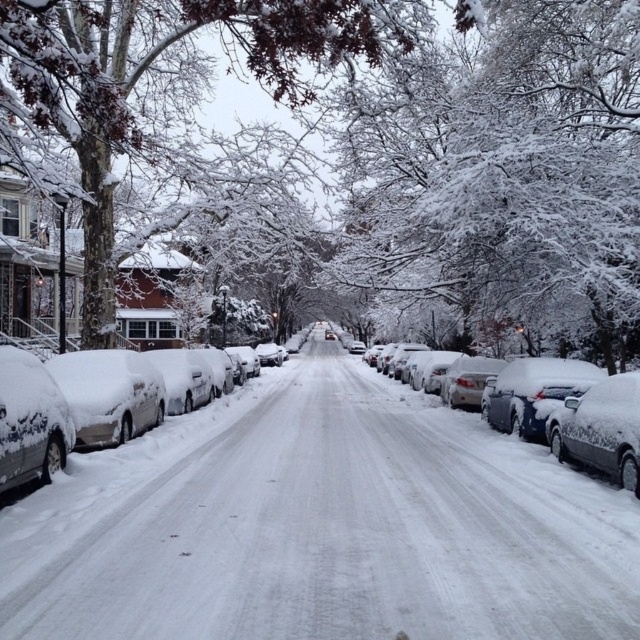
Question: Which object is the farthest from the snow-covered sedan at center?

Choices:
 (A) snow-covered tree at left
 (B) white snow-covered tree at center

Answer: (A)

Question: Considering the real-world distances, which object is farthest from the sleek silver sedan at left?

Choices:
 (A) snow-covered tree at left
 (B) sleek silver sedan at right

Answer: (B)

Question: Considering the relative positions of white snow-covered tree at center and sleek silver sedan at right in the image provided, where is white snow-covered tree at center located with respect to sleek silver sedan at right?

Choices:
 (A) below
 (B) above

Answer: (B)

Question: Is snow-covered tree at left smaller than snow-covered sedan at center?

Choices:
 (A) no
 (B) yes

Answer: (A)

Question: Does white snow-covered tree at center lie in front of sleek silver sedan at left?

Choices:
 (A) yes
 (B) no

Answer: (B)

Question: Estimate the real-world distances between objects in this image. Which object is closer to the snow-covered sedan at center?

Choices:
 (A) sleek silver sedan at right
 (B) sleek silver sedan at left
 (C) white snow-covered tree at center
 (D) snow-covered tree at left

Answer: (A)